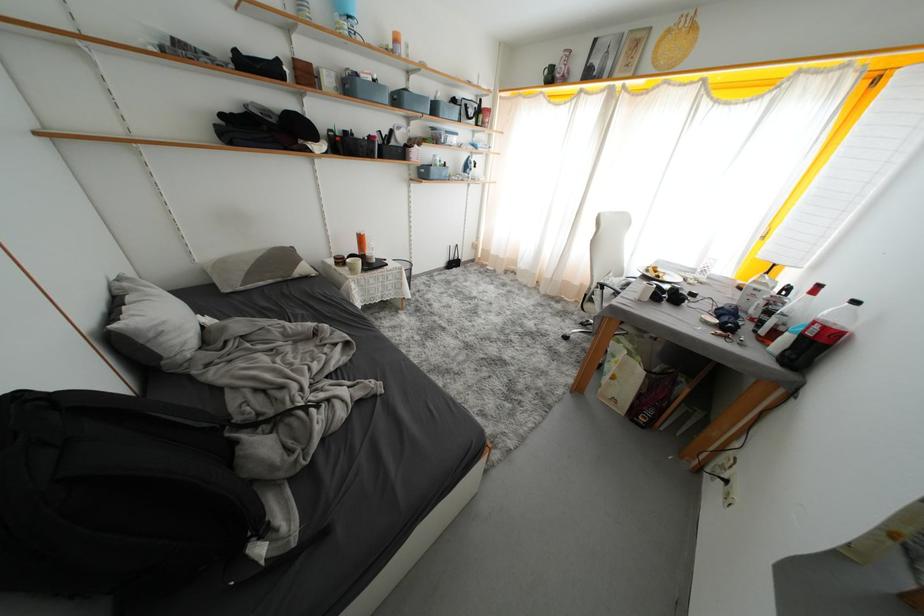
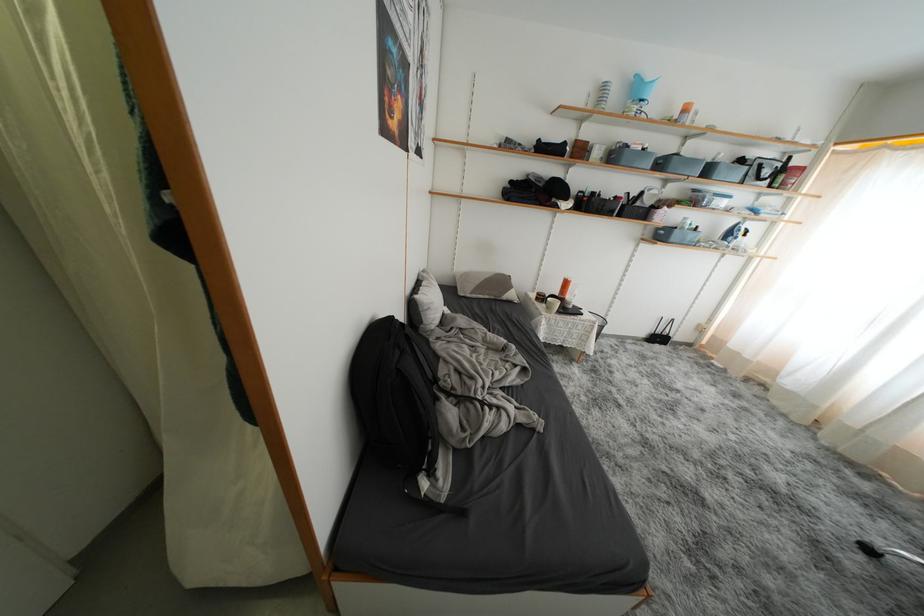
Find the pixel in the second image that matches (x=339, y=79) in the first image.

(610, 152)